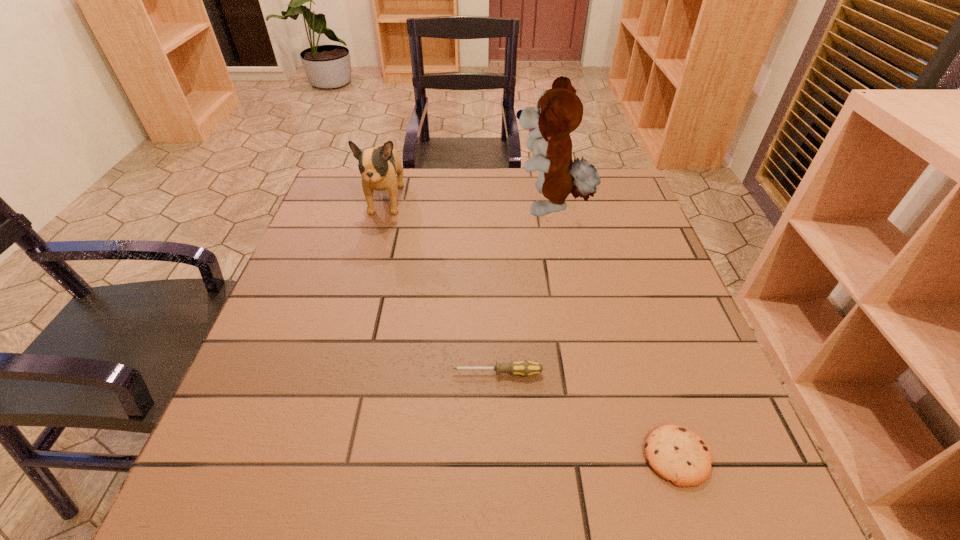
In order to click on vacant space that satisfies the following two spatial constraints: 1. on the face of the taller puppy; 2. on the right side of the cookie in this screenshot , I will do `click(600, 456)`.

Locate an element on the screen. This screenshot has height=540, width=960. free space that satisfies the following two spatial constraints: 1. at the face of the nearest object; 2. on the right side of the left puppy is located at coordinates (318, 456).

The width and height of the screenshot is (960, 540). Find the location of `vacant space that satisfies the following two spatial constraints: 1. at the tip of the screwdriver; 2. on the back side of the cookie`. vacant space that satisfies the following two spatial constraints: 1. at the tip of the screwdriver; 2. on the back side of the cookie is located at coordinates (500, 456).